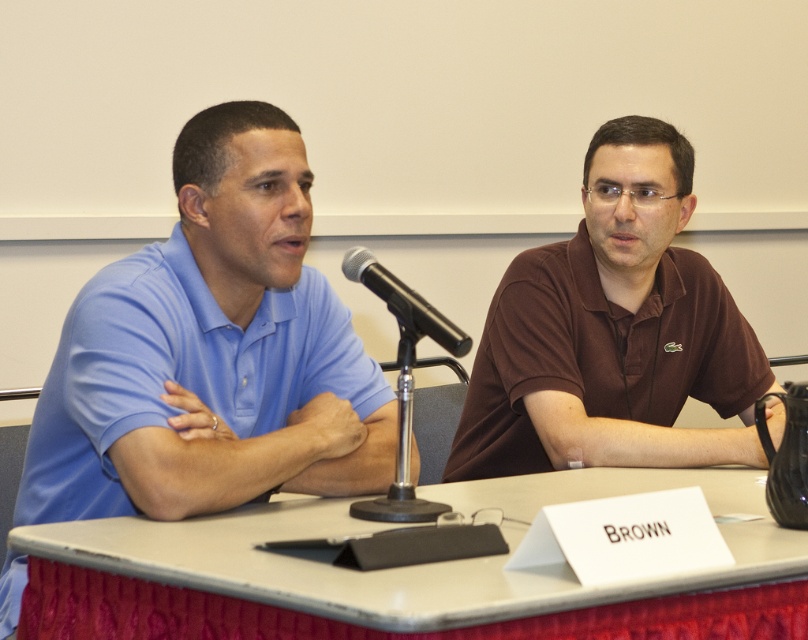
Question: Does matte blue polo shirt at left have a smaller size compared to smooth white table at center?

Choices:
 (A) no
 (B) yes

Answer: (A)

Question: Which point is closer to the camera?

Choices:
 (A) (646, 403)
 (B) (407, 310)

Answer: (B)

Question: Which point is farther to the camera?

Choices:
 (A) smooth white table at center
 (B) brown matte shirt at center
 (C) matte blue polo shirt at left
 (D) black metallic microphone at center

Answer: (B)

Question: Among these points, which one is nearest to the camera?

Choices:
 (A) (158, 260)
 (B) (93, 541)
 (C) (453, 330)

Answer: (B)

Question: Can you confirm if matte blue polo shirt at left is positioned to the right of black metallic microphone at center?

Choices:
 (A) yes
 (B) no

Answer: (B)

Question: Is brown matte shirt at center to the right of smooth white table at center from the viewer's perspective?

Choices:
 (A) no
 (B) yes

Answer: (B)